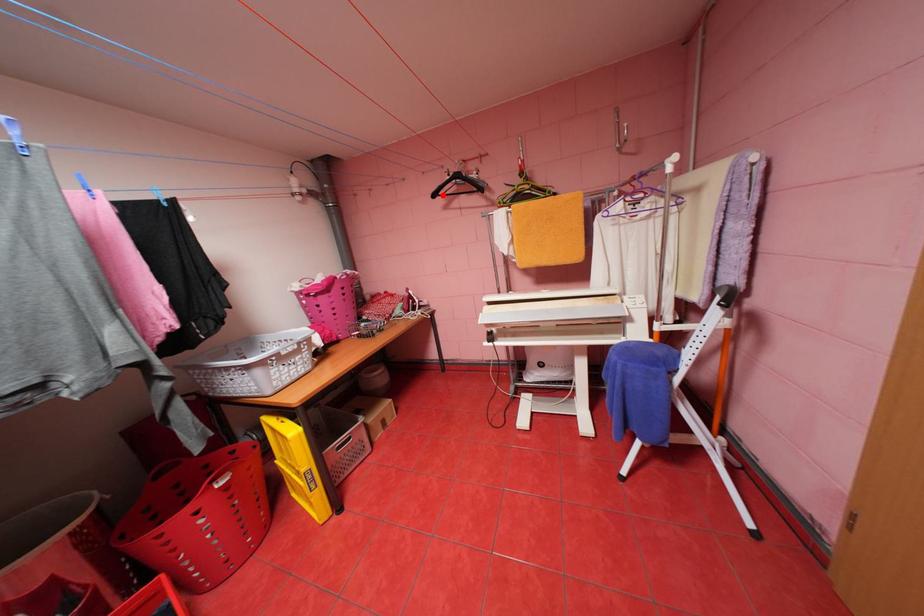
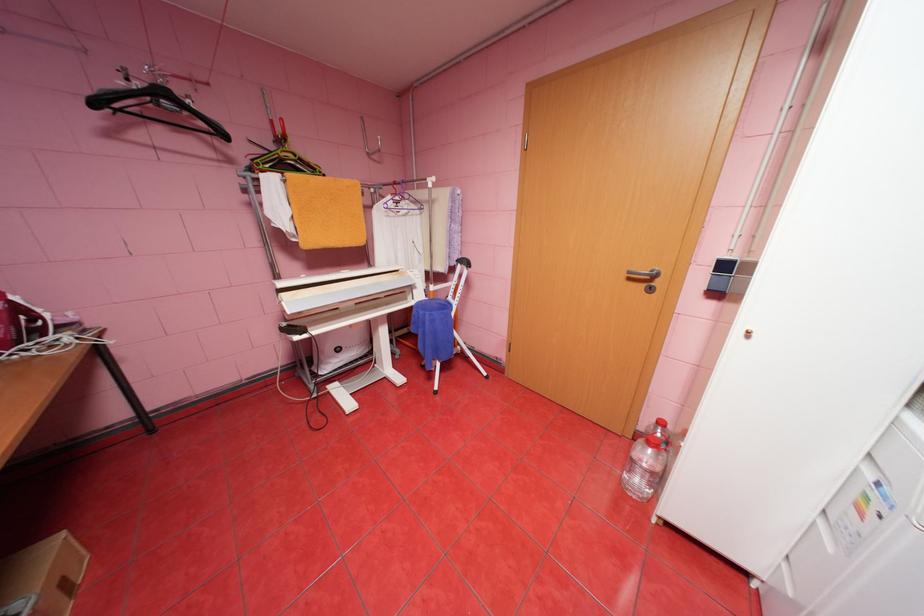
The point at the highlighted location is marked in the first image. Where is the corresponding point in the second image?

(103, 103)